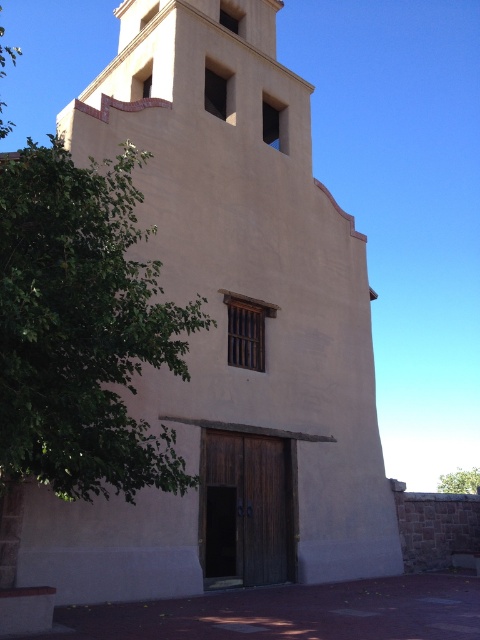
You are planning to install a new fence that needs to be placed between the green leafy tree at left and the green leafy tree at lower right. Which tree requires a smaller fence width to accommodate its spread?

The green leafy tree at left requires a smaller fence width because it has a lesser width compared to the green leafy tree at lower right.

You are standing in front of the building and see a green leafy tree at left. Where is the point at location [82,328] located?

The point at [82,328] is on the green leafy tree at left.